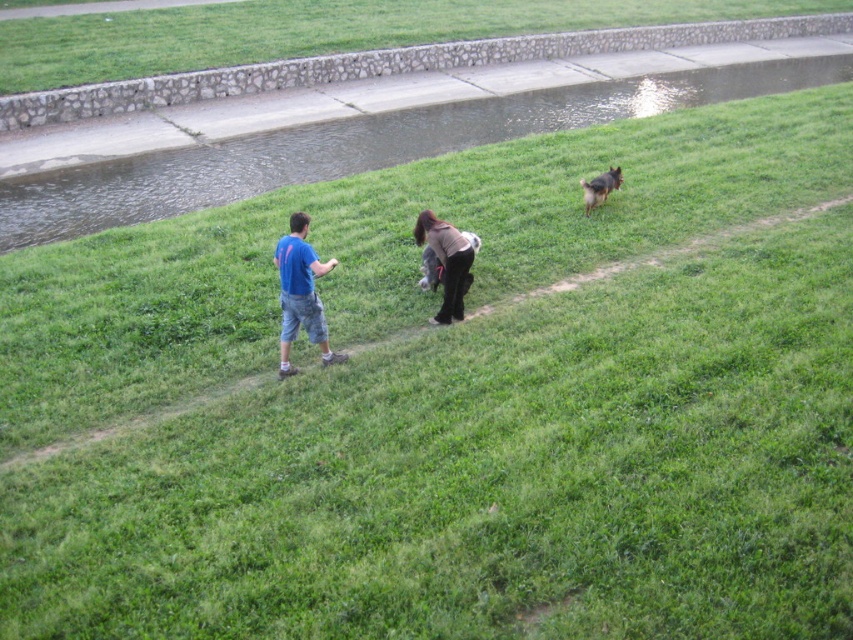
You are planning to cross the smooth concrete creek at upper center while walking along the dirt path. Based on the scene description, is the creek directly in your path or off to the side?

The smooth concrete creek at upper center is located at point coordinates, which places it directly in the path of the dirt path where the man and woman are walking. Therefore, the creek is directly in your path.

You are planning to cross the smooth concrete creek at upper center with a small wooden bridge that is 1.2 meters wide. Can the bridge fit across the creek if the dark brown sweater at center is placed on the bridge?

The smooth concrete creek at upper center might be wider than dark brown sweater at center, so the bridge might not be wide enough to cross the creek since the sweater is placed on it.